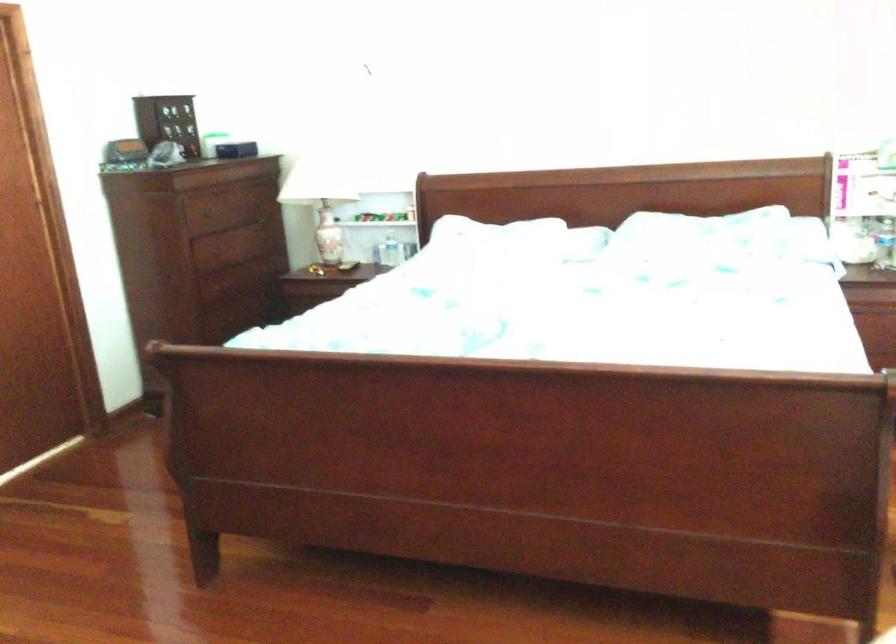
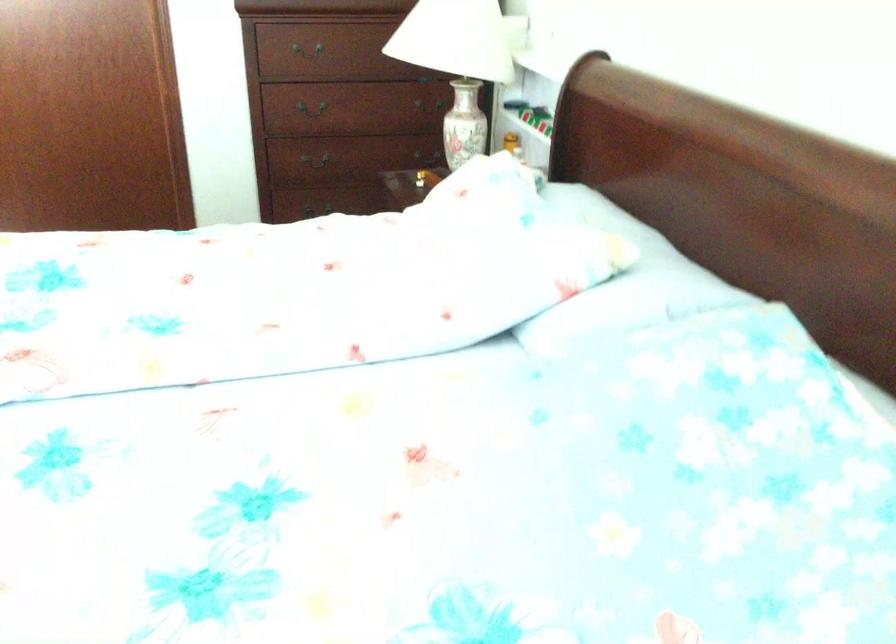
In the second image, find the point that corresponds to [231,274] in the first image.

(313, 108)